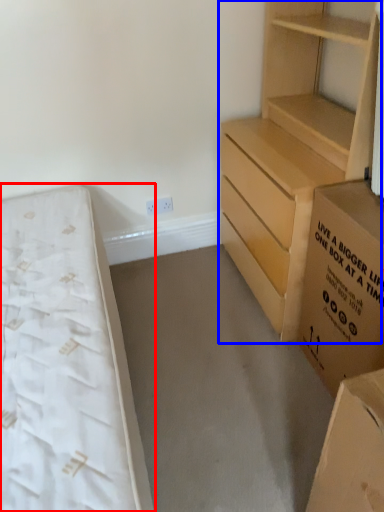
Question: Which of the following is the farthest to the observer, bed (highlighted by a red box) or chest of drawers (highlighted by a blue box)?

Choices:
 (A) bed
 (B) chest of drawers

Answer: (B)